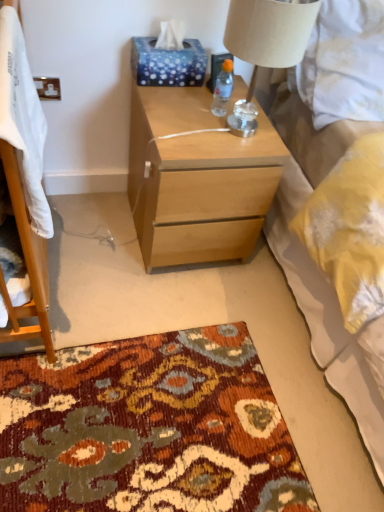
Locate an element on the screen. vacant area that is in front of transparent plastic bottle at upper center is located at coordinates (208, 133).